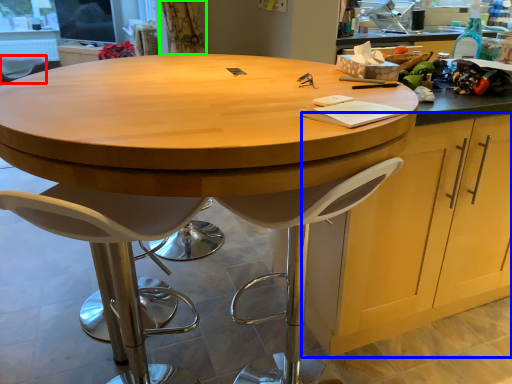
Question: Estimate the real-world distances between objects in this image. Which object is closer to chair (highlighted by a red box), cabinetry (highlighted by a blue box) or curtain (highlighted by a green box)?

Choices:
 (A) cabinetry
 (B) curtain

Answer: (B)